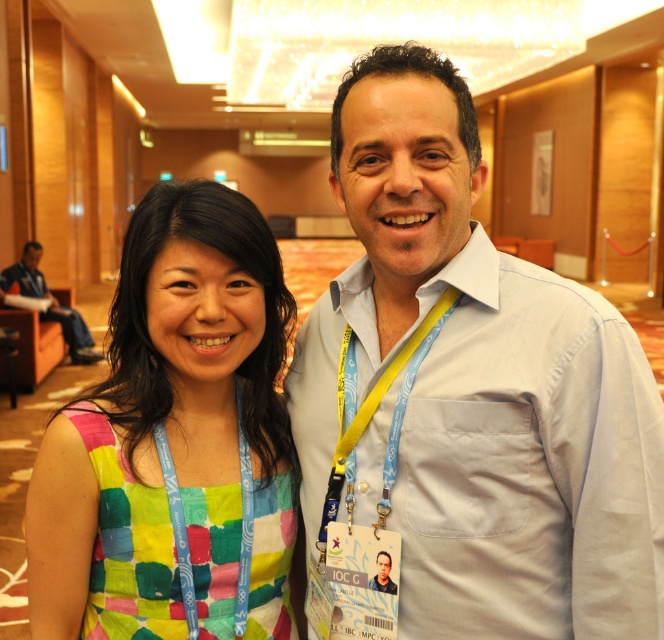
Question: Is patchwork fabric dress at center to the left of blue denim jeans at left from the viewer's perspective?

Choices:
 (A) yes
 (B) no

Answer: (B)

Question: Which point appears farthest from the camera in this image?

Choices:
 (A) (343, 394)
 (B) (205, 576)
 (C) (169, 474)

Answer: (A)

Question: Does blue fabric lanyard at center have a greater width compared to matte white shirt at center?

Choices:
 (A) yes
 (B) no

Answer: (A)

Question: Which point is farther from the camera taking this photo?

Choices:
 (A) (199, 413)
 (B) (171, 506)
 (C) (76, 314)

Answer: (C)

Question: Is patchwork fabric dress at center smaller than yellow fabric lanyard at center?

Choices:
 (A) yes
 (B) no

Answer: (B)

Question: Which point is closer to the camera?

Choices:
 (A) (353, 476)
 (B) (41, 292)

Answer: (A)